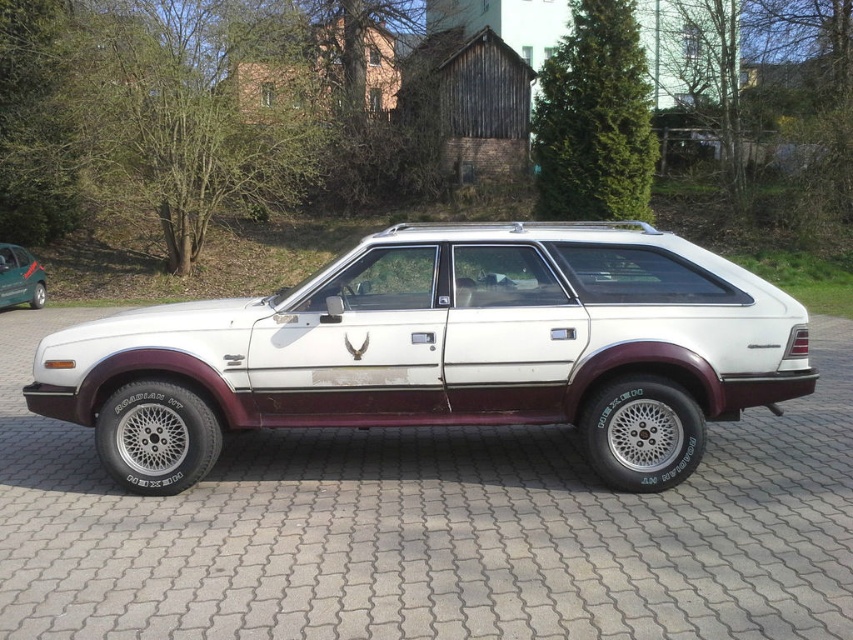
Question: Among these objects, which one is nearest to the camera?

Choices:
 (A) white matte station wagon at center
 (B) green matte hatchback at left
 (C) white paved driveway at center

Answer: (C)

Question: Which object is positioned farthest from the white matte station wagon at center?

Choices:
 (A) white paved driveway at center
 (B) green matte hatchback at left

Answer: (B)

Question: Which point is closer to the camera?

Choices:
 (A) green matte hatchback at left
 (B) white paved driveway at center

Answer: (B)

Question: Is white paved driveway at center closer to camera compared to green matte hatchback at left?

Choices:
 (A) yes
 (B) no

Answer: (A)

Question: Is white paved driveway at center positioned in front of green matte hatchback at left?

Choices:
 (A) no
 (B) yes

Answer: (B)

Question: Considering the relative positions of white paved driveway at center and white matte station wagon at center in the image provided, where is white paved driveway at center located with respect to white matte station wagon at center?

Choices:
 (A) above
 (B) below

Answer: (B)